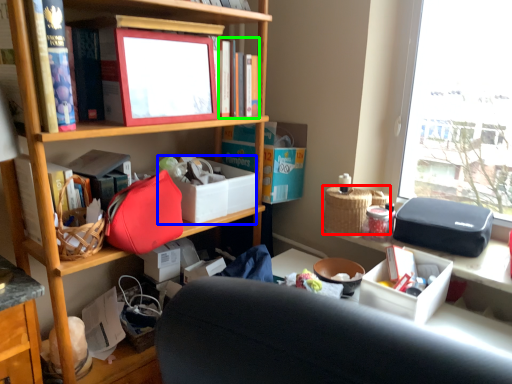
Question: Based on their relative distances, which object is farther from picnic basket (highlighted by a red box)? Choose from storage box (highlighted by a blue box) and book (highlighted by a green box).

Choices:
 (A) storage box
 (B) book

Answer: (B)